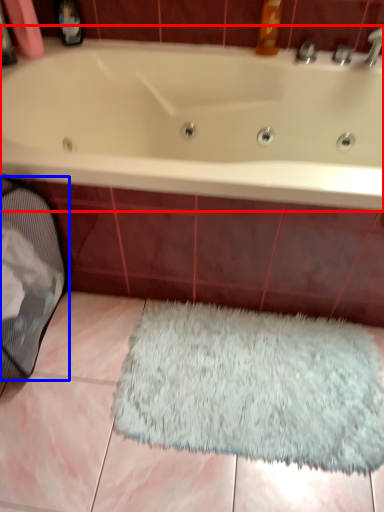
Question: Among these objects, which one is nearest to the camera, bathtub (highlighted by a red box) or laundry basket (highlighted by a blue box)?

Choices:
 (A) bathtub
 (B) laundry basket

Answer: (B)